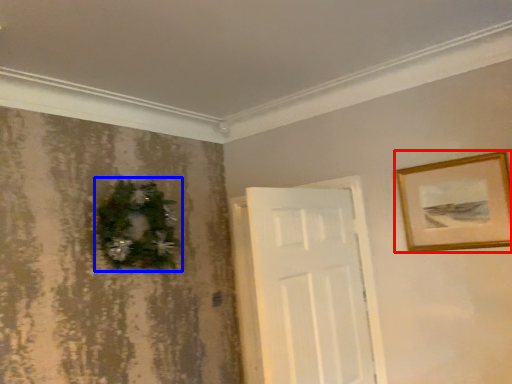
Question: Which of the following is the farthest to the observer, picture frame (highlighted by a red box) or christmas decoration (highlighted by a blue box)?

Choices:
 (A) picture frame
 (B) christmas decoration

Answer: (B)